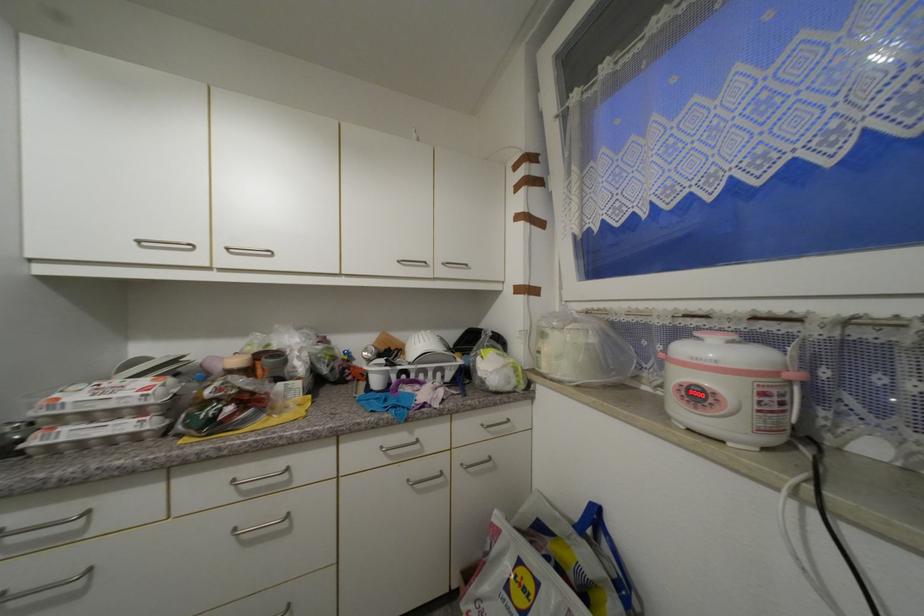
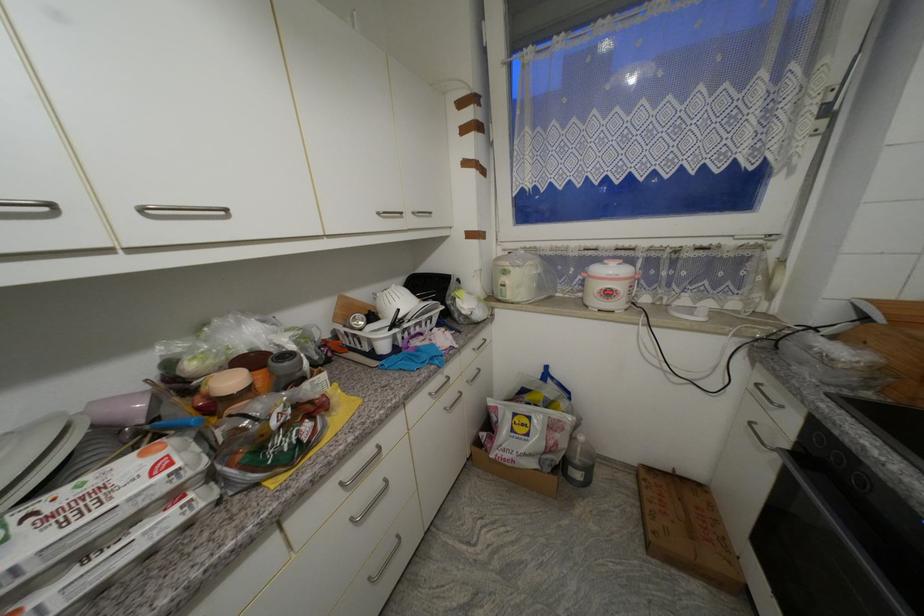
Locate, in the second image, the point that corresponds to point (234, 251) in the first image.

(149, 211)